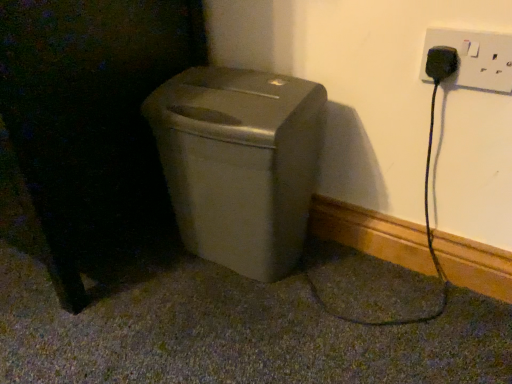
Question: From a real-world perspective, is satin beige trash can at center located higher than white plastic plug at upper right?

Choices:
 (A) no
 (B) yes

Answer: (A)

Question: Does satin beige trash can at center lie behind white plastic plug at upper right?

Choices:
 (A) no
 (B) yes

Answer: (B)

Question: From a real-world perspective, does satin beige trash can at center sit lower than white plastic plug at upper right?

Choices:
 (A) no
 (B) yes

Answer: (B)

Question: Does satin beige trash can at center touch white plastic plug at upper right?

Choices:
 (A) yes
 (B) no

Answer: (B)

Question: Does satin beige trash can at center have a lesser width compared to white plastic plug at upper right?

Choices:
 (A) no
 (B) yes

Answer: (A)

Question: Is satin beige trash can at center aimed at white plastic plug at upper right?

Choices:
 (A) yes
 (B) no

Answer: (B)

Question: Is black matte cat at left looking in the opposite direction of white plastic plug at upper right?

Choices:
 (A) no
 (B) yes

Answer: (A)

Question: Can we say black matte cat at left lies outside white plastic plug at upper right?

Choices:
 (A) no
 (B) yes

Answer: (B)

Question: Considering the relative sizes of black matte cat at left and white plastic plug at upper right in the image provided, is black matte cat at left thinner than white plastic plug at upper right?

Choices:
 (A) no
 (B) yes

Answer: (A)

Question: Does black matte cat at left appear on the right side of white plastic plug at upper right?

Choices:
 (A) yes
 (B) no

Answer: (B)

Question: Considering the relative positions of black matte cat at left and white plastic plug at upper right in the image provided, is black matte cat at left in front of white plastic plug at upper right?

Choices:
 (A) no
 (B) yes

Answer: (B)

Question: Can you confirm if black matte cat at left is taller than white plastic plug at upper right?

Choices:
 (A) no
 (B) yes

Answer: (B)

Question: Is black matte cat at left wider than satin beige trash can at center?

Choices:
 (A) yes
 (B) no

Answer: (A)